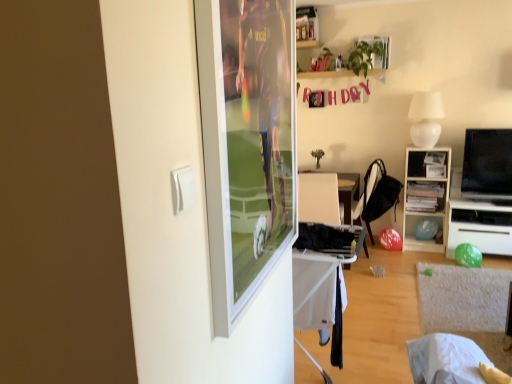
Question: Is white matte lampshade at upper right to the left or to the right of black fabric chair at center in the image?

Choices:
 (A) right
 (B) left

Answer: (A)

Question: Is white matte lampshade at upper right taller or shorter than black fabric chair at center?

Choices:
 (A) tall
 (B) short

Answer: (B)

Question: Estimate the real-world distances between objects in this image. Which object is closer to the white matte lampshade at upper right?

Choices:
 (A) white fabric table at lower center
 (B) black fabric chair at center
 (C) metallic silver shelf at upper center
 (D) black glossy tv at right
 (E) wooden bookshelf at right

Answer: (E)

Question: Which object is the farthest from the white fabric table at lower center?

Choices:
 (A) black glossy tv at right
 (B) black fabric laundry at center
 (C) wooden bookshelf at right
 (D) black fabric chair at center
 (E) metallic silver shelf at upper center

Answer: (E)